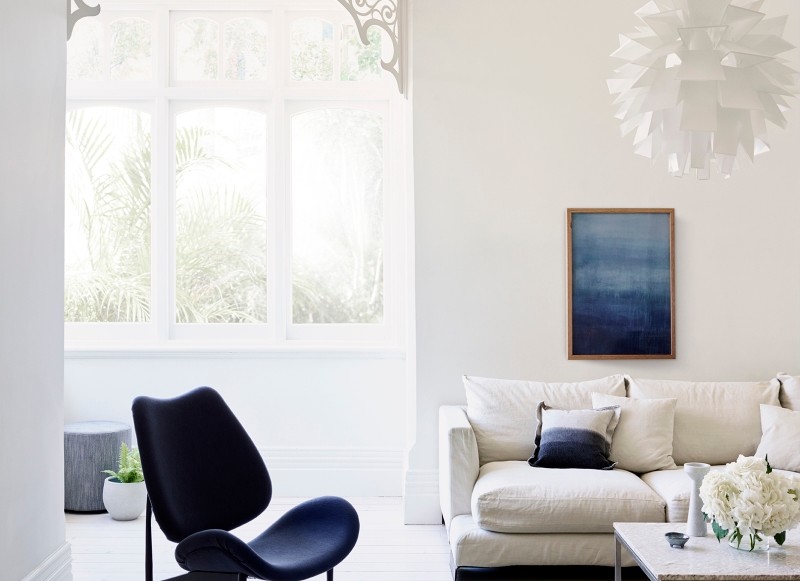
I want to click on pillow, so click(x=628, y=415).